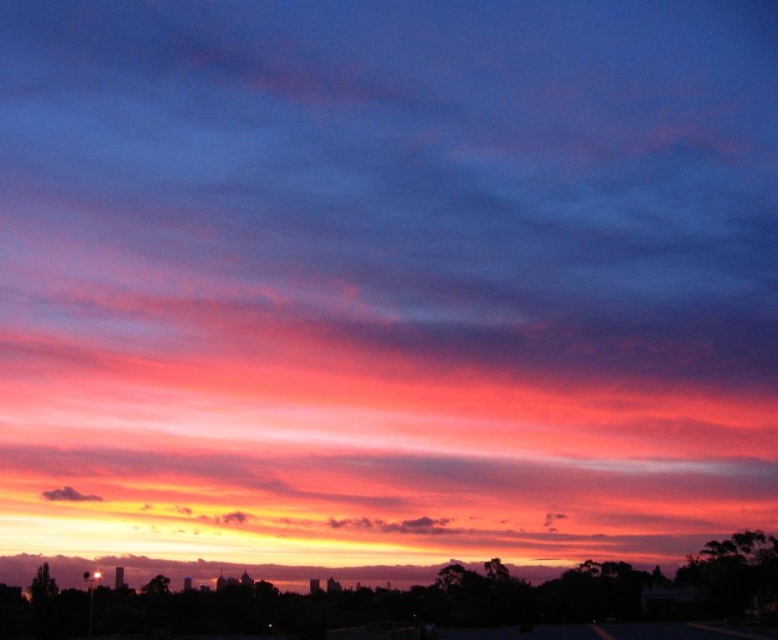
You are an artist trying to paint the sunset scene. You want to ensure the silhouette skyline at lower center and the dark gray cloud at lower left are proportionally accurate. Which object should you make bigger in your painting?

The silhouette skyline at lower center should be made bigger in the painting since it has a larger size compared to the dark gray cloud at lower left according to the description.

You are an architect designing a new building and want to ensure it won t block the sunset view from the neighboring houses. Based on the image, which object in the scene has a greater width the silhouette skyline at lower center or the dark gray cloud at lower left?

The silhouette skyline at lower center might be wider than the dark gray cloud at lower left according to the description.

You are a drone operator planning to fly a drone between the silhouette skyline at lower center and the dark gray cloud at lower left. The drone has a maximum flight range of 60 meters. Can the drone safely fly between these two points without exceeding its range?

The silhouette skyline at lower center and dark gray cloud at lower left are 64.41 meters apart from each other. Since the drone has a maximum flight range of 60 meters, it cannot safely fly between these two points without exceeding its range.